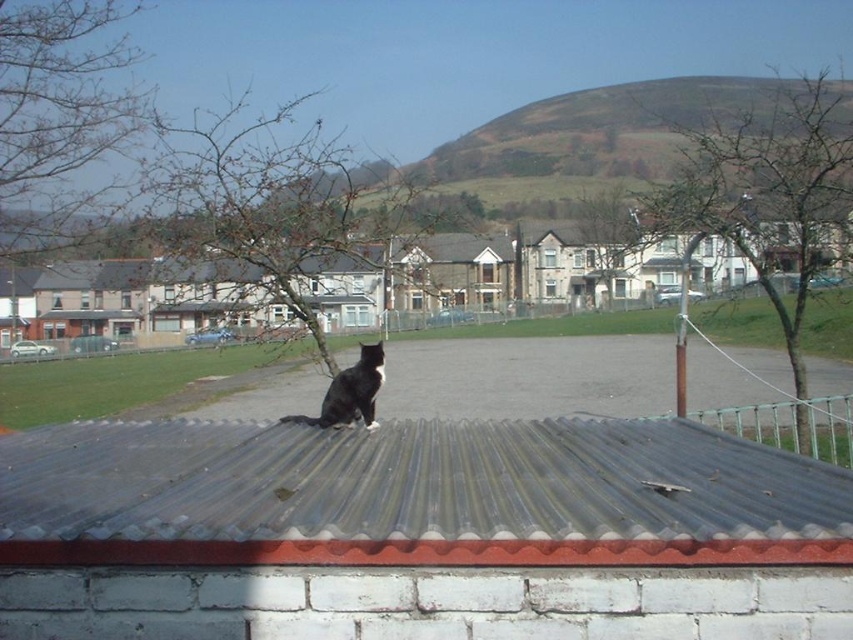
You are a bird looking for a place to land. You see two sets of bare branches at center and bare branches at left. Which set of branches would you choose if you want to land on the larger one?

The bare branches at center has a larger size compared to the bare branches at left, so you should choose the bare branches at center.

Looking at this image, you are a bird looking for a higher perch. You see two options in the image, the bare branches at center and the bare branches at left. Which one should you choose to get a higher vantage point?

The bare branches at center is much taller than the bare branches at left, so you should choose the bare branches at center to get a higher vantage point.

You are a photographer trying to capture the black fur cat at center and the green leafy tree at upper center in the same frame. Based on their positions, will the cat appear in front of or behind the tree in the photo?

The black fur cat at center is behind the green leafy tree at upper center, so the cat will appear behind the tree in the photo.